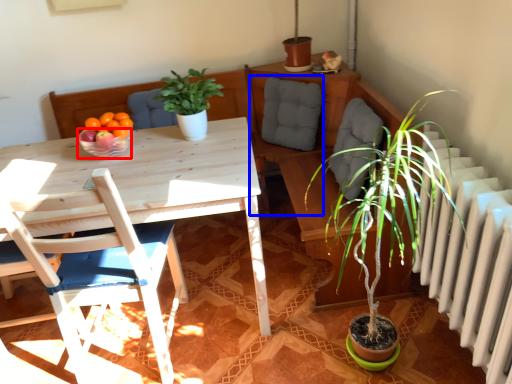
Question: Which object appears farthest to the camera in this image, bowl (highlighted by a red box) or swivel chair (highlighted by a blue box)?

Choices:
 (A) bowl
 (B) swivel chair

Answer: (B)